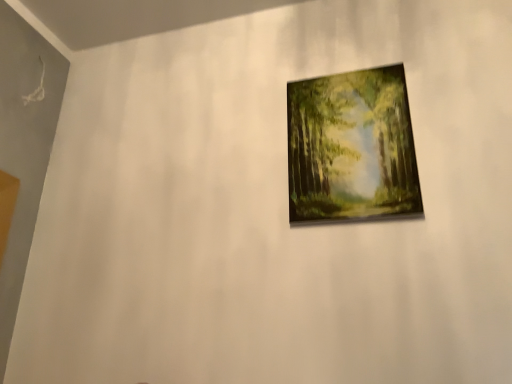
The height and width of the screenshot is (384, 512). What do you see at coordinates (351, 149) in the screenshot? I see `wooden painting at center` at bounding box center [351, 149].

Find the location of `wooden painting at center`. wooden painting at center is located at coordinates (351, 149).

In order to face wooden painting at center, should I rotate leftwards or rightwards?

To align with it, rotate right about 12.240°.

Where is `wooden painting at center`? The height and width of the screenshot is (384, 512). wooden painting at center is located at coordinates (351, 149).